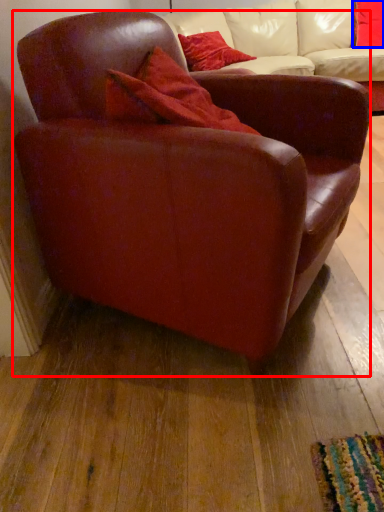
Question: Which point is further to the camera, chair (highlighted by a red box) or pillow (highlighted by a blue box)?

Choices:
 (A) chair
 (B) pillow

Answer: (B)